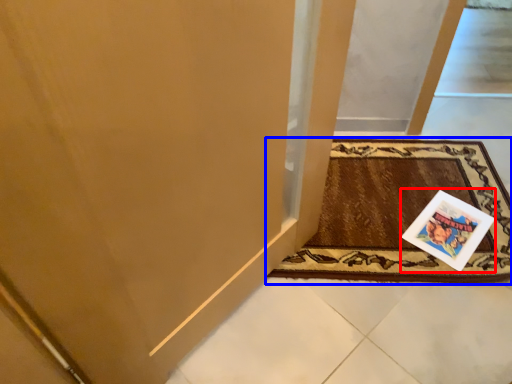
Question: Which object is further to the camera taking this photo, postcard (highlighted by a red box) or mat (highlighted by a blue box)?

Choices:
 (A) postcard
 (B) mat

Answer: (A)